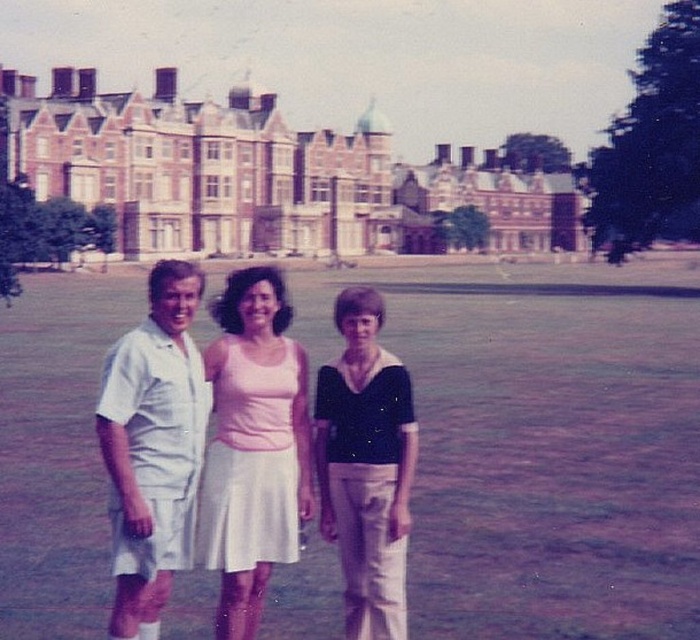
Question: Which object is positioned closest to the brown brick building at upper center?

Choices:
 (A) black matte shirt at center
 (B) green grass at center
 (C) pink fabric dress at center
 (D) white cotton shorts at left

Answer: (B)

Question: Among these objects, which one is farthest from the camera?

Choices:
 (A) brown brick building at upper center
 (B) black matte shirt at center
 (C) pink fabric dress at center

Answer: (A)

Question: Considering the relative positions of green grass at center and pink fabric dress at center in the image provided, where is green grass at center located with respect to pink fabric dress at center?

Choices:
 (A) right
 (B) left

Answer: (A)

Question: Which point is farther to the camera?

Choices:
 (A) white cotton shorts at left
 (B) brown brick building at upper center
 (C) black matte shirt at center

Answer: (B)

Question: Is brown brick building at upper center to the right of pink fabric dress at center from the viewer's perspective?

Choices:
 (A) no
 (B) yes

Answer: (B)

Question: In this image, where is brown brick building at upper center located relative to black matte shirt at center?

Choices:
 (A) below
 (B) above

Answer: (B)